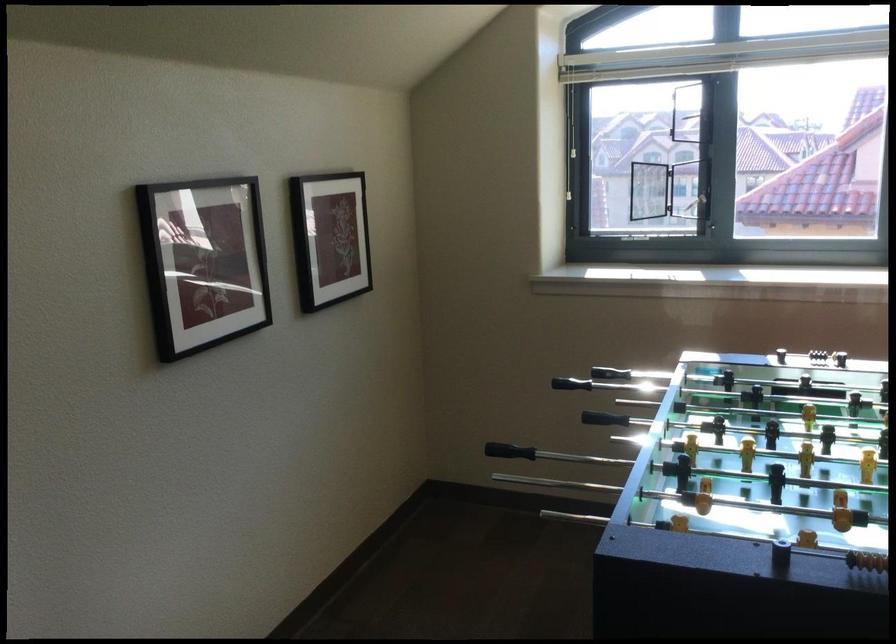
Find the location of a particular element. window lever handle is located at coordinates (692, 116).